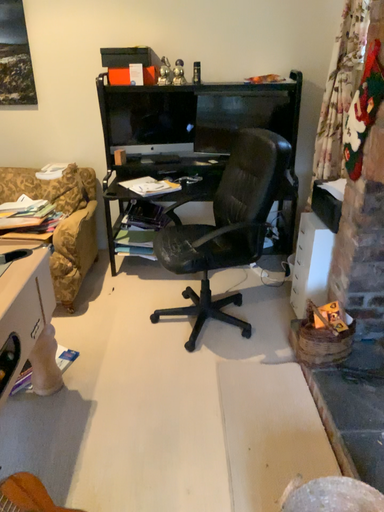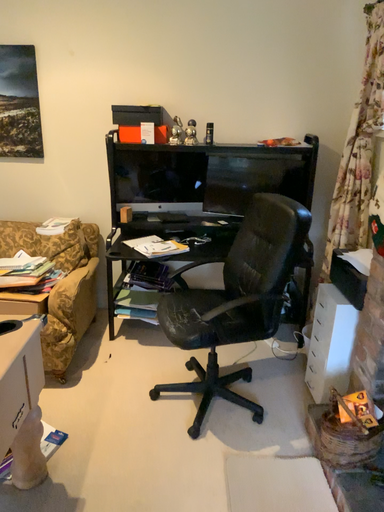
Question: How did the camera likely rotate when shooting the video?

Choices:
 (A) rotated upward
 (B) rotated downward

Answer: (A)